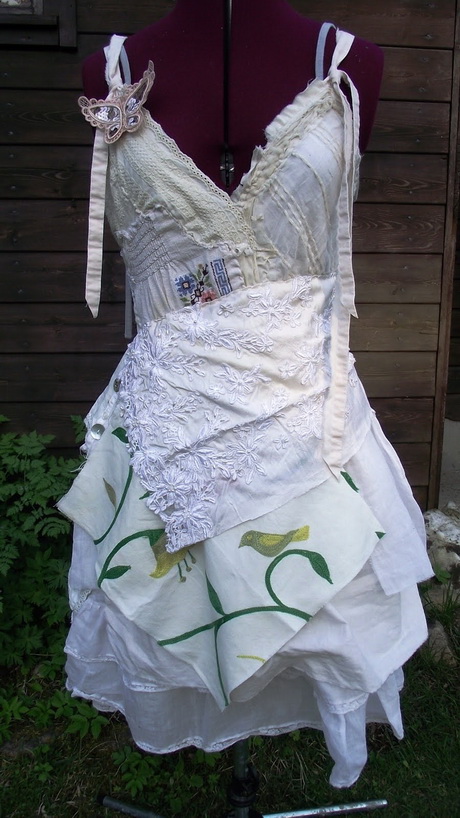
The height and width of the screenshot is (818, 460). What are the coordinates of `hinge` in the screenshot? It's located at (229, 169).